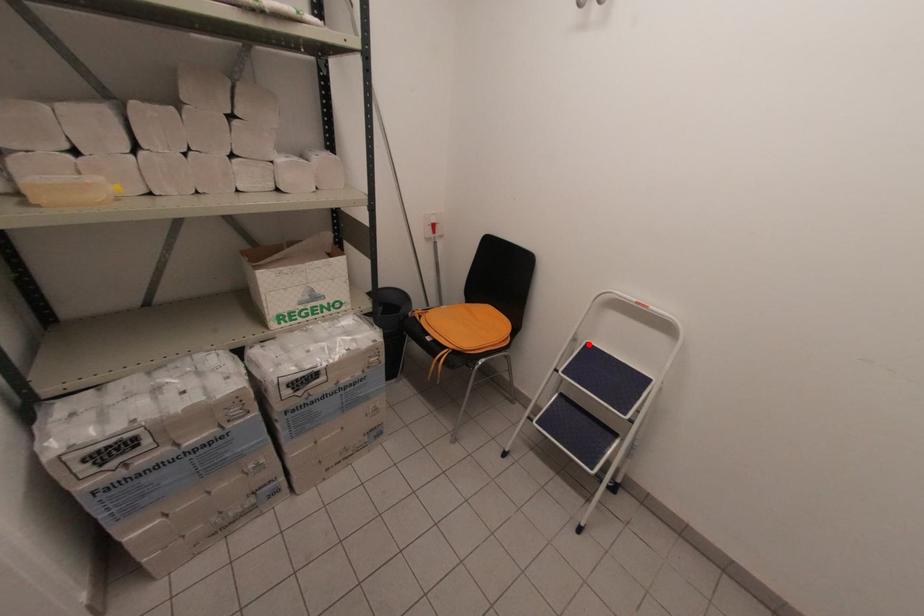
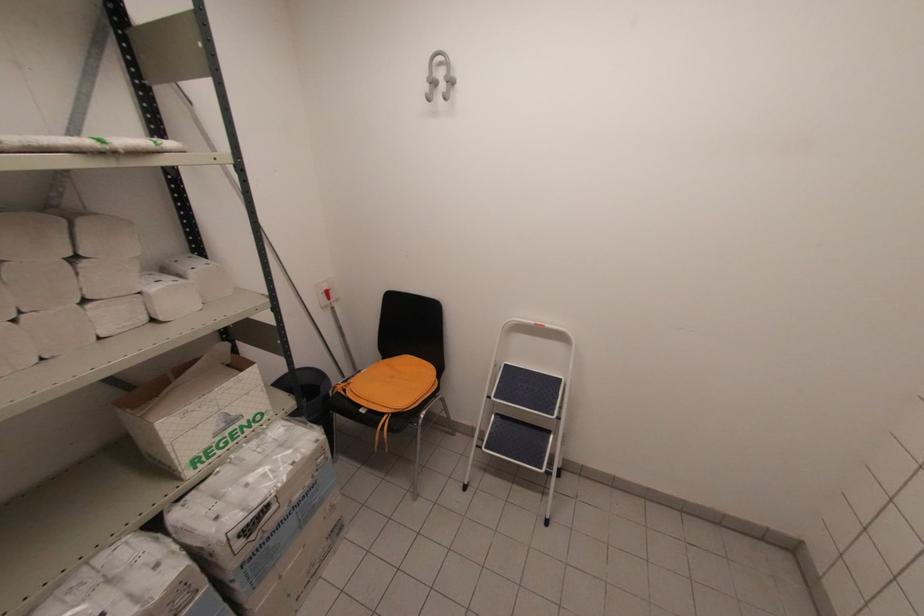
Locate, in the second image, the point that corresponds to the highlighted location in the first image.

(506, 366)